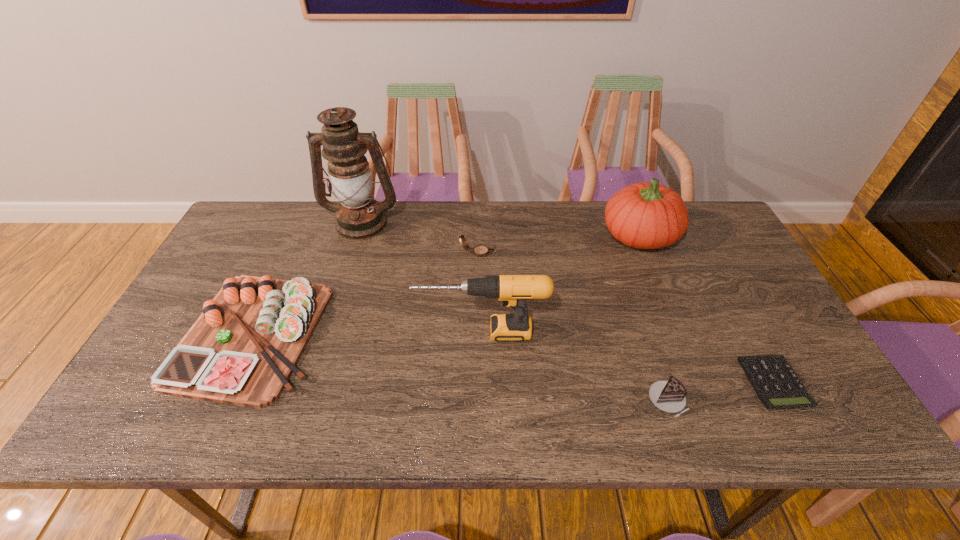
Where is `the tallest object`? The image size is (960, 540). the tallest object is located at coordinates (359, 217).

Locate an element on the screen. pumpkin is located at coordinates tap(647, 215).

This screenshot has height=540, width=960. Find the location of `drill`. drill is located at coordinates (513, 290).

Identify the location of platter. (242, 350).

Where is `compass`? This screenshot has width=960, height=540. compass is located at coordinates (480, 250).

The width and height of the screenshot is (960, 540). What are the coordinates of `chocolate cake` in the screenshot? It's located at (669, 396).

Find the location of a particular element. calculator is located at coordinates (775, 382).

The height and width of the screenshot is (540, 960). In order to click on free space located on the left of the lantern in this screenshot , I will do `click(245, 222)`.

You are a GUI agent. You are given a task and a screenshot of the screen. Output one action in this format:
    pyautogui.click(x=<x>, y=<y>)
    Task: Click on the free space located on the front of the pumpkin
    The width and height of the screenshot is (960, 540).
    Given the screenshot: What is the action you would take?
    pyautogui.click(x=657, y=278)

The image size is (960, 540). In order to click on free spot located on the handle side of the drill in this screenshot , I will do `click(397, 332)`.